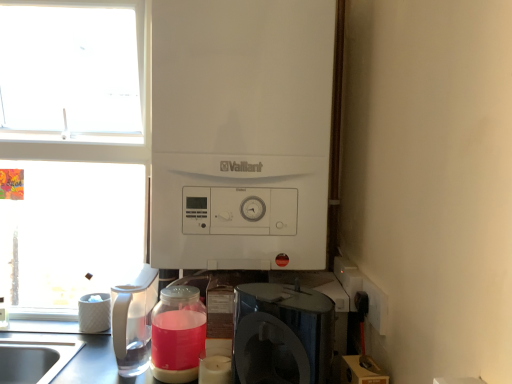
Question: Considering the positions of white matte window at upper left and clear plastic pitcher at left in the image, is white matte window at upper left wider or thinner than clear plastic pitcher at left?

Choices:
 (A) thin
 (B) wide

Answer: (A)

Question: In terms of height, does white matte window at upper left look taller or shorter compared to clear plastic pitcher at left?

Choices:
 (A) short
 (B) tall

Answer: (B)

Question: Which object is the closest to the translucent glass jar at center?

Choices:
 (A) white matte window at upper left
 (B) white matte boiler at center, which is the second appliance from bottom to top
 (C) white textured container at left, the 2th appliance in the front-to-back sequence
 (D) clear plastic pitcher at left
 (E) satin black coffee maker at lower center

Answer: (D)

Question: Considering the real-world distances, which object is closest to the white matte window at upper left?

Choices:
 (A) white matte boiler at center, which is the 1th appliance in top-to-bottom order
 (B) translucent glass jar at center
 (C) satin black coffee maker at lower center
 (D) white plastic electric outlet at lower right
 (E) white textured container at left, the first appliance when ordered from back to front

Answer: (E)